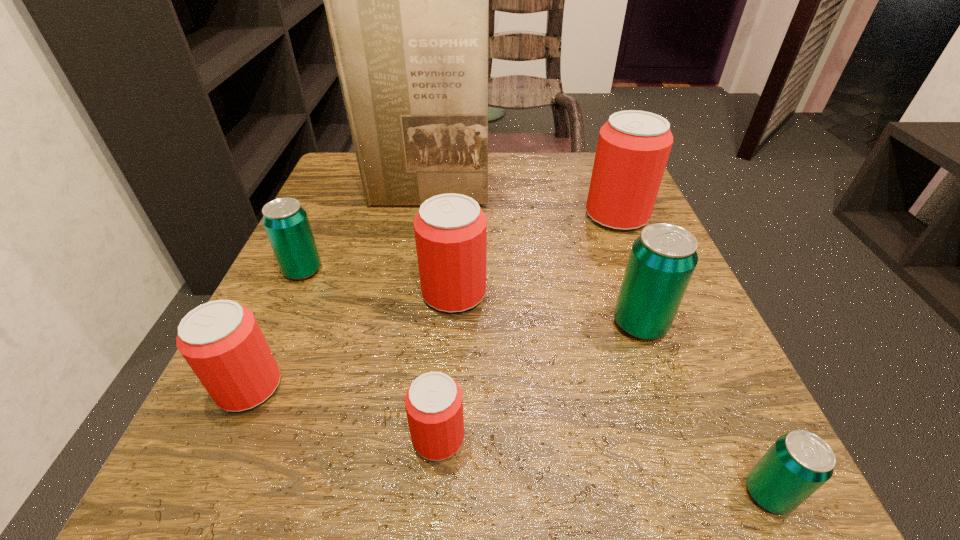
Identify the location of phonebook. The height and width of the screenshot is (540, 960). (407, 0).

At what (x,y) coordinates should I click in order to perform the action: click on the biggest red beer can. Please return your answer as a coordinate pair (x, y). This screenshot has width=960, height=540. Looking at the image, I should click on (633, 147).

Find the location of a particular element. The image size is (960, 540). the farthest beer can is located at coordinates (633, 147).

Find the location of a particular element. The width and height of the screenshot is (960, 540). the third nearest red beer can is located at coordinates (450, 230).

Where is `the biggest teal beer can`? the biggest teal beer can is located at coordinates (663, 258).

Identify the location of the second teal beer can from left to right. The width and height of the screenshot is (960, 540). (663, 258).

Identify the location of the third biggest red beer can. (221, 340).

You are a GUI agent. You are given a task and a screenshot of the screen. Output one action in this format:
    pyautogui.click(x=<x>, y=<y>)
    Task: Click on the farthest teal beer can
    This screenshot has width=960, height=540.
    Given the screenshot: What is the action you would take?
    pyautogui.click(x=286, y=223)

You are a GUI agent. You are given a task and a screenshot of the screen. Output one action in this format:
    pyautogui.click(x=<x>, y=<y>)
    Task: Click on the leftmost teal beer can
    The width and height of the screenshot is (960, 540).
    Given the screenshot: What is the action you would take?
    pyautogui.click(x=286, y=223)

At what (x,y) coordinates should I click in order to perform the action: click on the smallest red beer can. Please return your answer as a coordinate pair (x, y). This screenshot has width=960, height=540. Looking at the image, I should click on (434, 404).